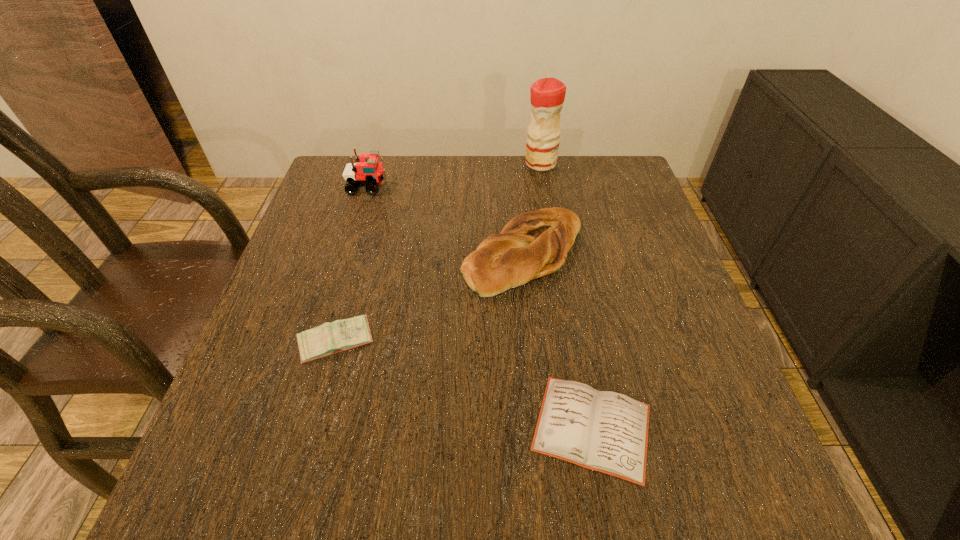
Image resolution: width=960 pixels, height=540 pixels. I want to click on the farthest object, so click(547, 97).

At what (x,y) coordinates should I click in order to perform the action: click on the tallest object. Please return your answer as a coordinate pair (x, y). Looking at the image, I should click on (547, 97).

At what (x,y) coordinates should I click in order to perform the action: click on the fourth nearest object. Please return your answer as a coordinate pair (x, y). Looking at the image, I should click on (368, 172).

Locate an element on the screen. This screenshot has height=540, width=960. the second tallest object is located at coordinates (368, 172).

Find the location of a particular element. Image resolution: width=960 pixels, height=540 pixels. the third shortest object is located at coordinates click(534, 244).

Identify the location of the third nearest object. (534, 244).

This screenshot has height=540, width=960. What are the coordinates of `the fourth tallest object` in the screenshot? It's located at (330, 338).

Locate an element on the screen. the fourth farthest object is located at coordinates (330, 338).

At what (x,y) coordinates should I click in order to perform the action: click on the right diary. Please return your answer as a coordinate pair (x, y). Image resolution: width=960 pixels, height=540 pixels. Looking at the image, I should click on (604, 431).

Image resolution: width=960 pixels, height=540 pixels. Identify the location of the nearer diary. (604, 431).